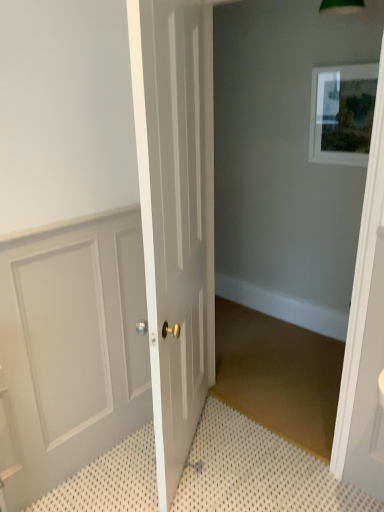
Question: Is matte white picture frame at upper right at the back of white textured bath mat at lower left?

Choices:
 (A) yes
 (B) no

Answer: (B)

Question: Is white textured bath mat at lower left bigger than matte white picture frame at upper right?

Choices:
 (A) yes
 (B) no

Answer: (A)

Question: Is the depth of white textured bath mat at lower left greater than that of matte white picture frame at upper right?

Choices:
 (A) yes
 (B) no

Answer: (B)

Question: Can you confirm if white textured bath mat at lower left is smaller than matte white picture frame at upper right?

Choices:
 (A) yes
 (B) no

Answer: (B)

Question: Is white textured bath mat at lower left at the right side of matte white picture frame at upper right?

Choices:
 (A) no
 (B) yes

Answer: (A)

Question: Considering the positions of point (155, 318) and point (360, 143), is point (155, 318) closer or farther from the camera than point (360, 143)?

Choices:
 (A) farther
 (B) closer

Answer: (B)

Question: Choose the correct answer: Is white glossy door at center, the first door positioned from the right, inside matte white picture frame at upper right or outside it?

Choices:
 (A) outside
 (B) inside

Answer: (A)

Question: Would you say white glossy door at center, the first door positioned from the right, is to the left or to the right of matte white picture frame at upper right in the picture?

Choices:
 (A) right
 (B) left

Answer: (B)

Question: From a real-world perspective, is white glossy door at center, the first door positioned from the right, physically located above or below matte white picture frame at upper right?

Choices:
 (A) below
 (B) above

Answer: (A)

Question: Does point 200,137 appear closer or farther from the camera than point 11,453?

Choices:
 (A) farther
 (B) closer

Answer: (A)

Question: Relative to white panelled door at left, positioned as the first door in left-to-right order, is white glossy door at center, the second door positioned from the left, in front or behind?

Choices:
 (A) behind
 (B) front

Answer: (B)

Question: From the image's perspective, relative to white panelled door at left, marked as the second door in a right-to-left arrangement, is white glossy door at center, the second door positioned from the left, above or below?

Choices:
 (A) above
 (B) below

Answer: (A)

Question: Is white glossy door at center, the first door positioned from the right, inside the boundaries of white panelled door at left, positioned as the first door in left-to-right order, or outside?

Choices:
 (A) inside
 (B) outside

Answer: (B)

Question: In terms of width, does white panelled door at left, marked as the second door in a right-to-left arrangement, look wider or thinner when compared to white textured bath mat at lower left?

Choices:
 (A) wide
 (B) thin

Answer: (B)

Question: From the image's perspective, relative to white textured bath mat at lower left, is white panelled door at left, marked as the second door in a right-to-left arrangement, above or below?

Choices:
 (A) above
 (B) below

Answer: (A)